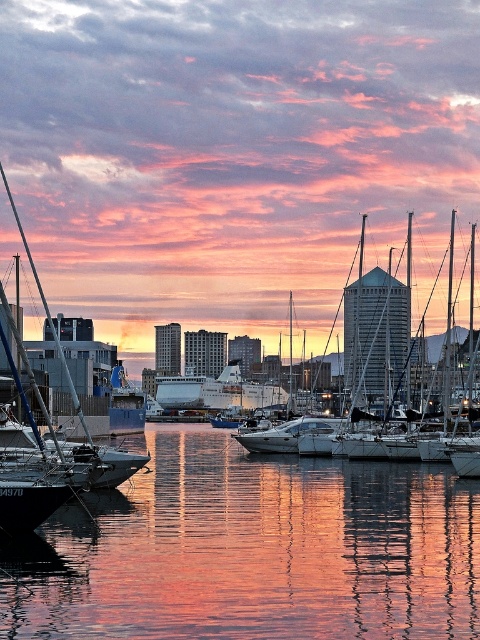
Can you confirm if white glossy sailboat at center is positioned to the right of white glossy cruise ship at center?

Indeed, white glossy sailboat at center is positioned on the right side of white glossy cruise ship at center.

Is white glossy sailboat at center behind white glossy cruise ship at center?

No, it is in front of white glossy cruise ship at center.

Is point (362, 320) positioned behind point (240, 394)?

No.

At what (x,y) coordinates should I click in order to perform the action: click on white glossy sailboat at center. Please return your answer as a coordinate pair (x, y). Looking at the image, I should click on (377, 337).

Which is more to the left, reflective glass water at center or white glossy cruise ship at center?

From the viewer's perspective, white glossy cruise ship at center appears more on the left side.

Is point (252, 625) closer to viewer compared to point (175, 397)?

That is True.

This screenshot has height=640, width=480. In order to click on reflective glass water at center in this screenshot , I will do `click(252, 550)`.

In the scene shown: Can you confirm if reflective glass water at center is shorter than white glossy sailboat at center?

Yes.

The image size is (480, 640). Describe the element at coordinates (252, 550) in the screenshot. I see `reflective glass water at center` at that location.

Describe the element at coordinates (252, 550) in the screenshot. I see `reflective glass water at center` at that location.

You are a GUI agent. You are given a task and a screenshot of the screen. Output one action in this format:
    pyautogui.click(x=<x>, y=<y>)
    Task: Click on the reflective glass water at center
    
    Given the screenshot: What is the action you would take?
    pyautogui.click(x=252, y=550)